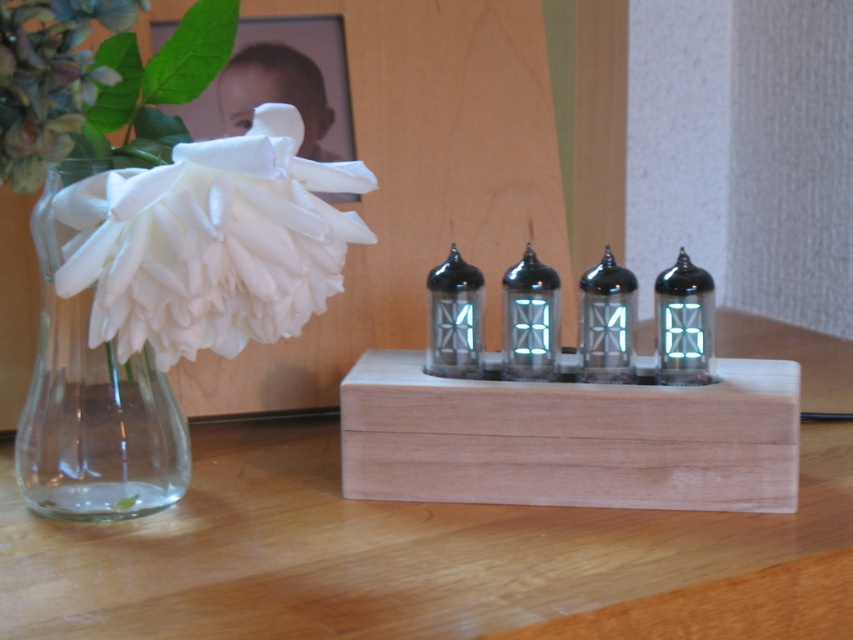
Image resolution: width=853 pixels, height=640 pixels. What do you see at coordinates (421, 556) in the screenshot? I see `natural wood table at center` at bounding box center [421, 556].

Can you confirm if natural wood table at center is taller than wooden frame at upper left?

Yes.

Is point (318, 532) more distant than point (245, 124)?

That is False.

The height and width of the screenshot is (640, 853). I want to click on natural wood table at center, so [421, 556].

Who is taller, white silk flower at left or wooden frame at upper left?

Standing taller between the two is white silk flower at left.

Is white silk flower at left below wooden frame at upper left?

Indeed, white silk flower at left is positioned under wooden frame at upper left.

Identify the location of white silk flower at left. This screenshot has width=853, height=640. (210, 243).

Who is more forward, (851, 586) or (250, 321)?

Positioned in front is point (250, 321).

Is natural wood table at center closer to camera compared to white silk flower at left?

No, it is not.

Between point (51, 596) and point (294, 156), which one is positioned in front?

Point (51, 596) is more forward.

You are a GUI agent. You are given a task and a screenshot of the screen. Output one action in this format:
    pyautogui.click(x=<x>, y=<y>)
    Task: Click on the natural wood table at center
    
    Given the screenshot: What is the action you would take?
    pyautogui.click(x=421, y=556)